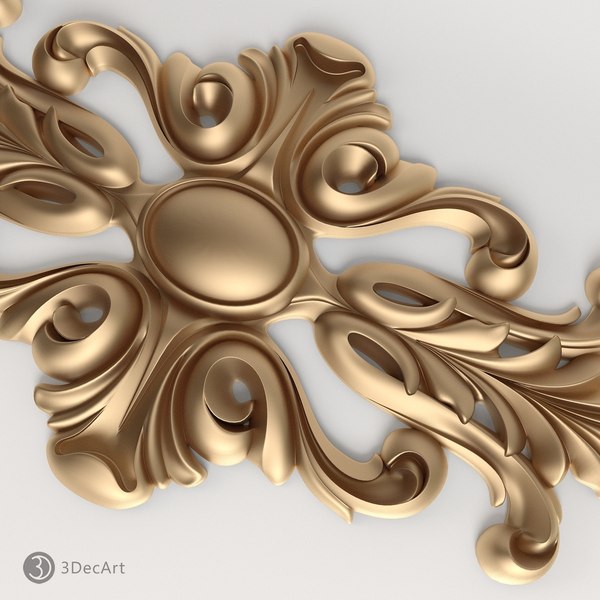
This screenshot has height=600, width=600. In order to click on tear drop size indentation in wall art in this screenshot , I will do `click(495, 237)`, `click(379, 479)`, `click(529, 542)`.